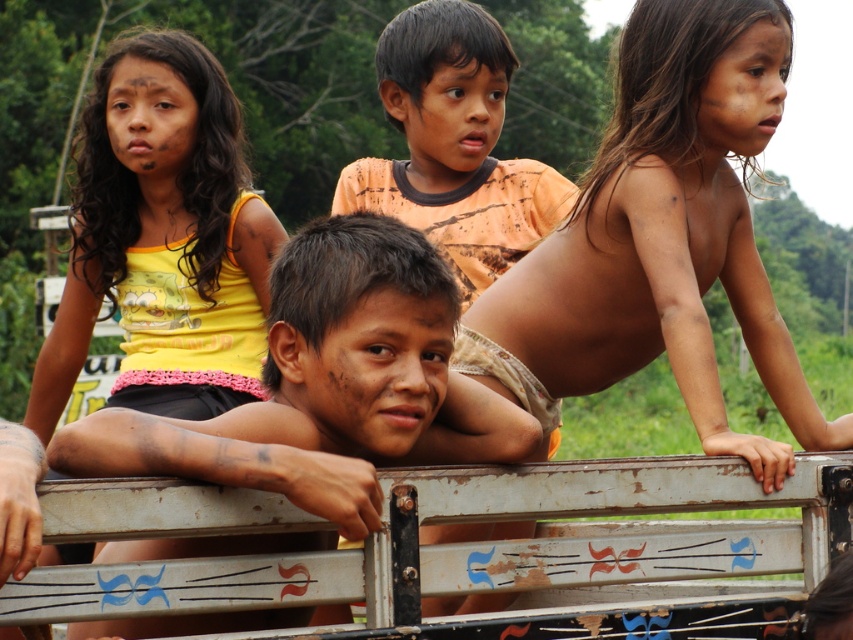
You are standing in front of the truck bed and want to place a small flag at one of the two points. Which point is closer to you, point (590, 333) or point (459, 244)?

Point (590, 333) is closer to the viewer than point (459, 244), so you should place the flag there.